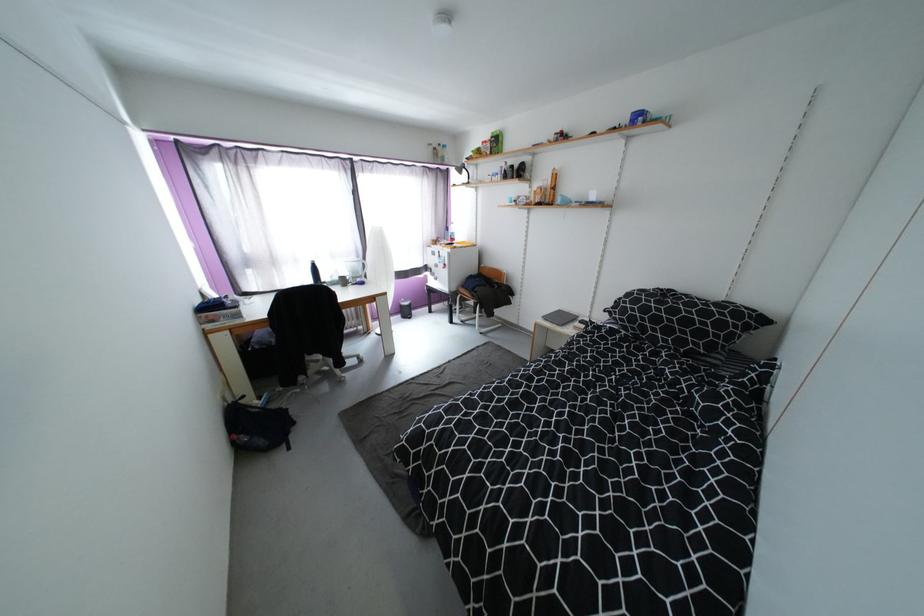
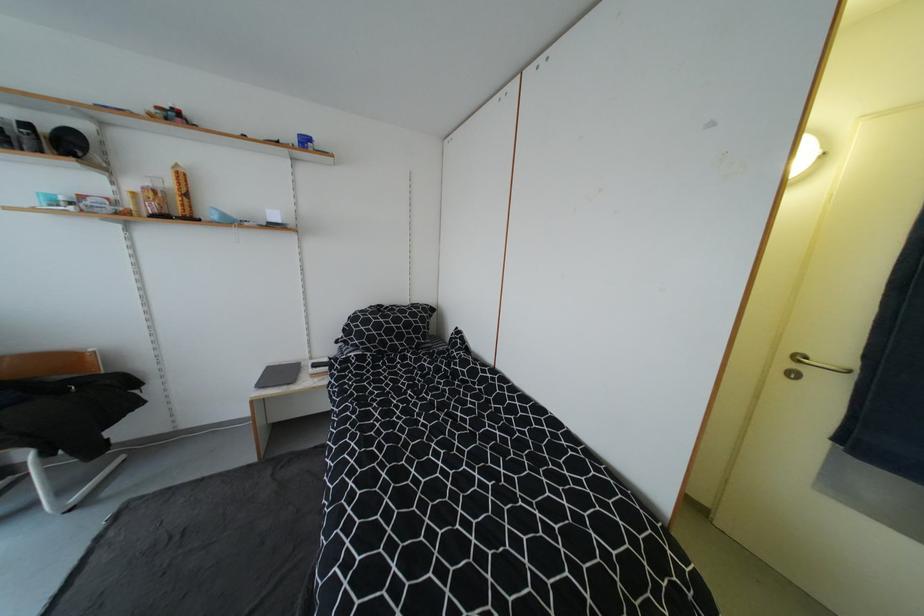
Question: How did the camera likely rotate?

Choices:
 (A) Left
 (B) Right
 (C) Up
 (D) Down

Answer: (B)